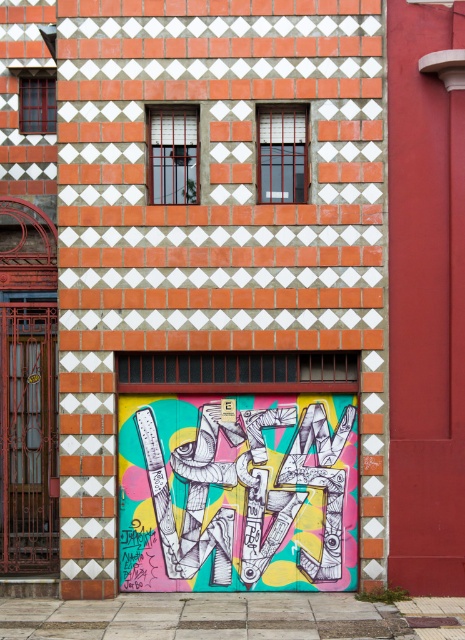
Question: Is colorful graffiti at center above metallic painted garage door at lower left?

Choices:
 (A) yes
 (B) no

Answer: (B)

Question: Which point is farther from the camera taking this photo?

Choices:
 (A) (35, 456)
 (B) (267, 456)

Answer: (A)

Question: Is colorful graffiti at center to the right of metallic painted garage door at lower left from the viewer's perspective?

Choices:
 (A) yes
 (B) no

Answer: (A)

Question: Which object appears closest to the camera in this image?

Choices:
 (A) metallic painted garage door at lower left
 (B) colorful graffiti at center

Answer: (B)

Question: Is the position of colorful graffiti at center more distant than that of metallic painted garage door at lower left?

Choices:
 (A) no
 (B) yes

Answer: (A)